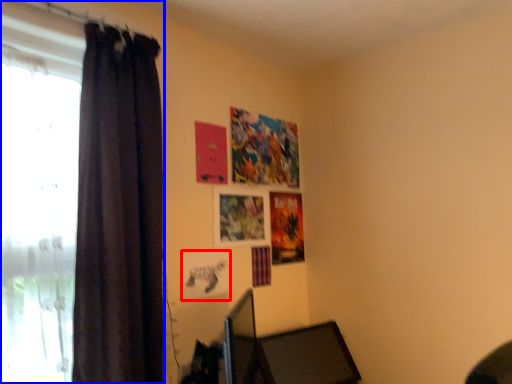
Question: Which object is closer to the camera taking this photo, picture frame (highlighted by a red box) or curtain (highlighted by a blue box)?

Choices:
 (A) picture frame
 (B) curtain

Answer: (B)